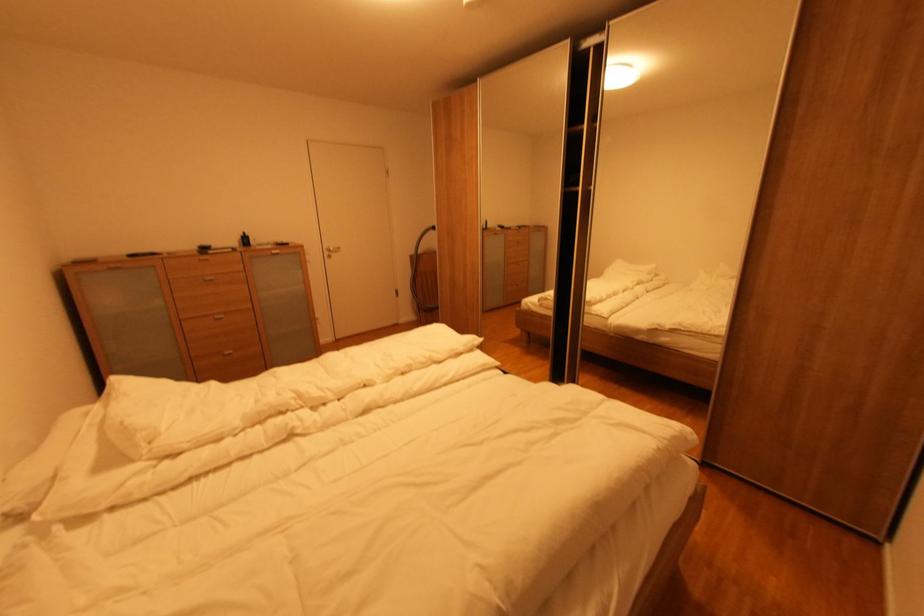
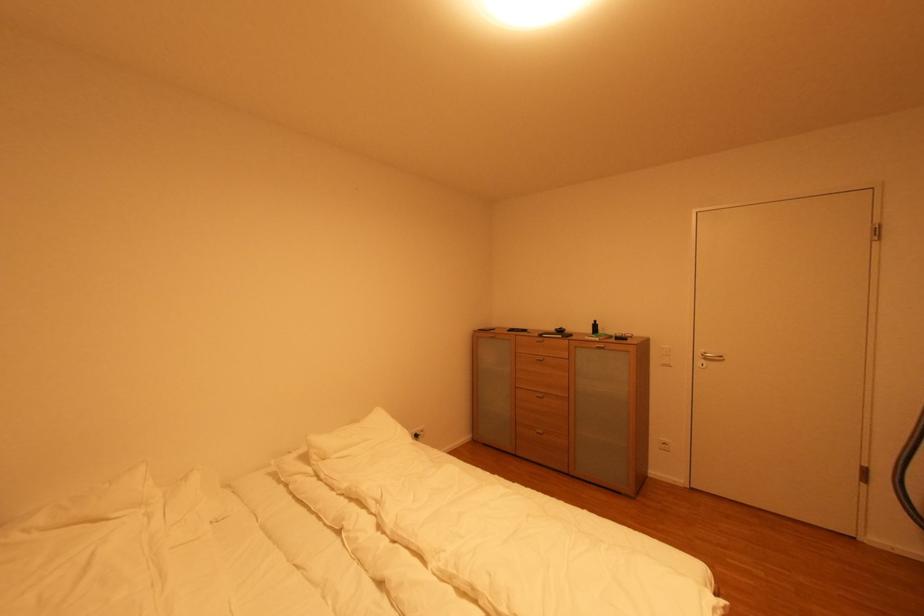
In the second image, find the point that corresponds to point (333, 254) in the first image.

(706, 362)